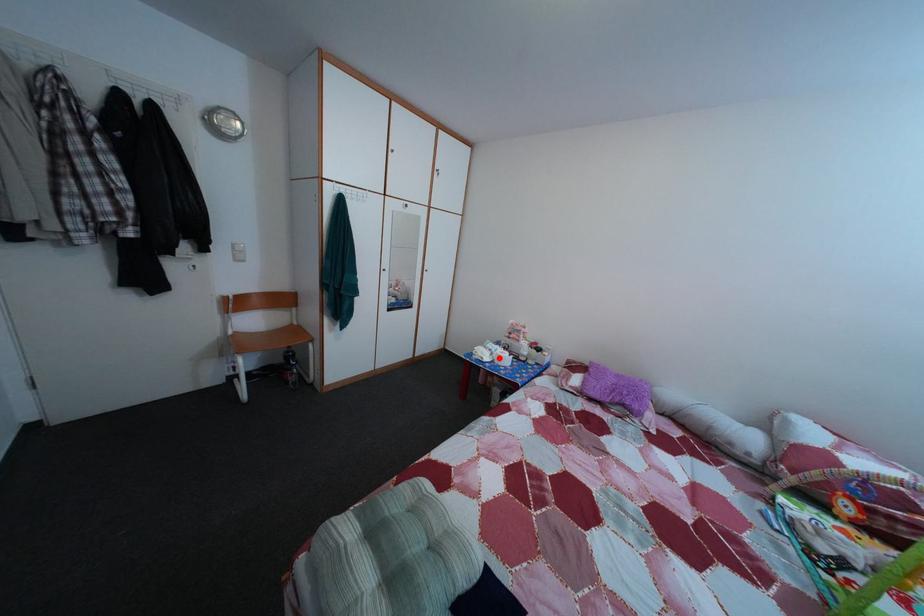
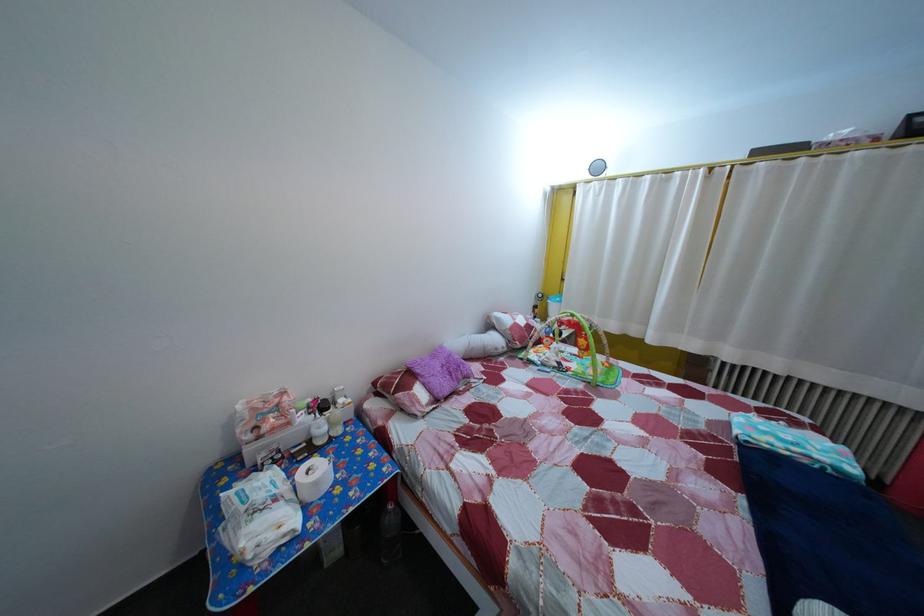
Question: I am providing you with two images of the same scene from different viewpoints. Image1 has a red point marked. In image2, the corresponding 3D location appears at what relative position? Reply with the corresponding letter.

Choices:
 (A) Closer
 (B) Farther

Answer: (A)